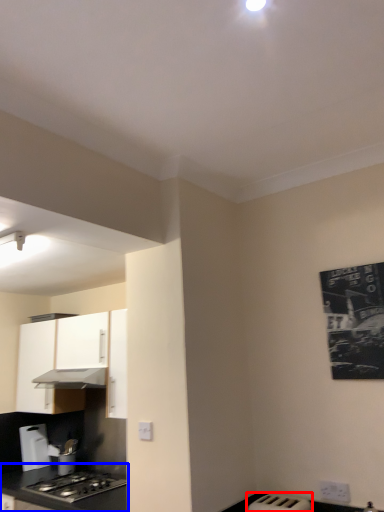
Question: Among these objects, which one is nearest to the camera, appliance (highlighted by a red box) or countertop (highlighted by a blue box)?

Choices:
 (A) appliance
 (B) countertop

Answer: (A)